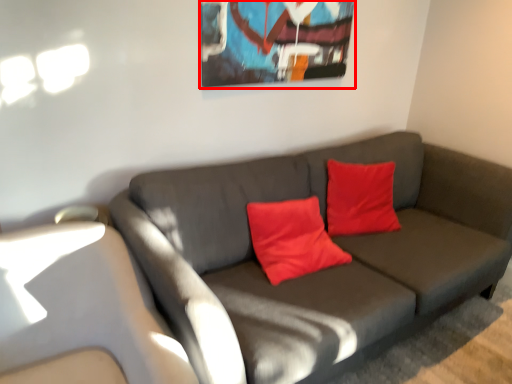
Question: Observing the image, what is the correct spatial positioning of picture frame (annotated by the red box) in reference to studio couch?

Choices:
 (A) left
 (B) right

Answer: (A)